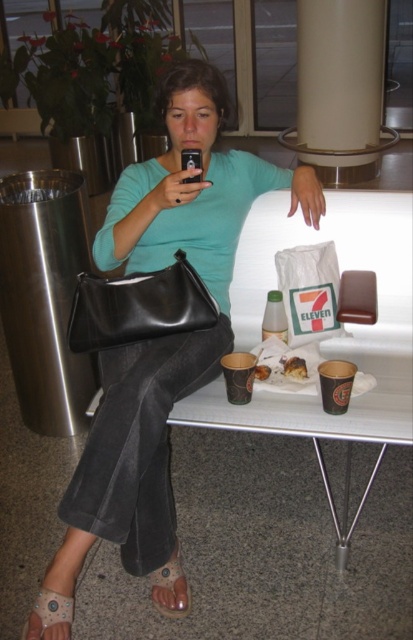
Does brown suede sandal at lower left appear on the left side of matte brown paper cup at center?

Correct, you'll find brown suede sandal at lower left to the left of matte brown paper cup at center.

Is brown suede sandal at lower left taller than matte brown paper cup at center?

Yes.

Which is in front, point (178, 548) or point (268, 371)?

Point (178, 548) is in front.

Locate an element on the screen. brown suede sandal at lower left is located at coordinates (170, 588).

Does matte black purse at center have a larger size compared to black leather bag at center?

Indeed, matte black purse at center has a larger size compared to black leather bag at center.

Between matte black purse at center and black leather bag at center, which one is positioned higher?

black leather bag at center is higher up.

Which is in front, point (154, 253) or point (204, 324)?

Point (204, 324) is in front.

This screenshot has width=413, height=640. I want to click on matte black purse at center, so (165, 337).

Which is below, black leather bag at center or matte brown paper cup at center?

matte brown paper cup at center is lower down.

Which is more to the right, black leather bag at center or matte brown paper cup at center?

matte brown paper cup at center is more to the right.

I want to click on black leather bag at center, so click(139, 307).